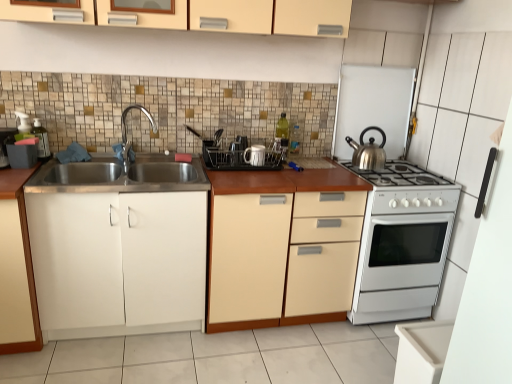
Question: From a real-world perspective, is shiny metallic kettle at right physically located above or below black plastic dish rack at center, acting as the third appliance starting from the right?

Choices:
 (A) below
 (B) above

Answer: (B)

Question: In terms of width, does shiny metallic kettle at right look wider or thinner when compared to black plastic dish rack at center, the third appliance in the left-to-right sequence?

Choices:
 (A) wide
 (B) thin

Answer: (B)

Question: Estimate the real-world distances between objects in this image. Which object is closer to the translucent plastic soap dispenser at left, which is the 1th appliance from left to right?

Choices:
 (A) chrome metallic faucet at left
 (B) white glossy mug at center, placed as the second appliance when sorted from right to left
 (C) shiny metallic kettle at right
 (D) white glossy oven at right
 (E) white matte cabinet at left, which is the third cabinetry in top-to-bottom order

Answer: (A)

Question: Which of these objects is positioned farthest from the matte cream cabinet at upper center, which is the fourth cabinetry from bottom to top?

Choices:
 (A) chrome metallic faucet at left
 (B) white matte cabinet at left, marked as the fourth cabinetry in a top-to-bottom arrangement
 (C) white matte cabinet at left, the second cabinetry positioned from the bottom
 (D) white glossy mug at center, the 4th appliance viewed from the left
 (E) silver metallic kettle at upper right, which is counted as the 5th appliance, starting from the left

Answer: (B)